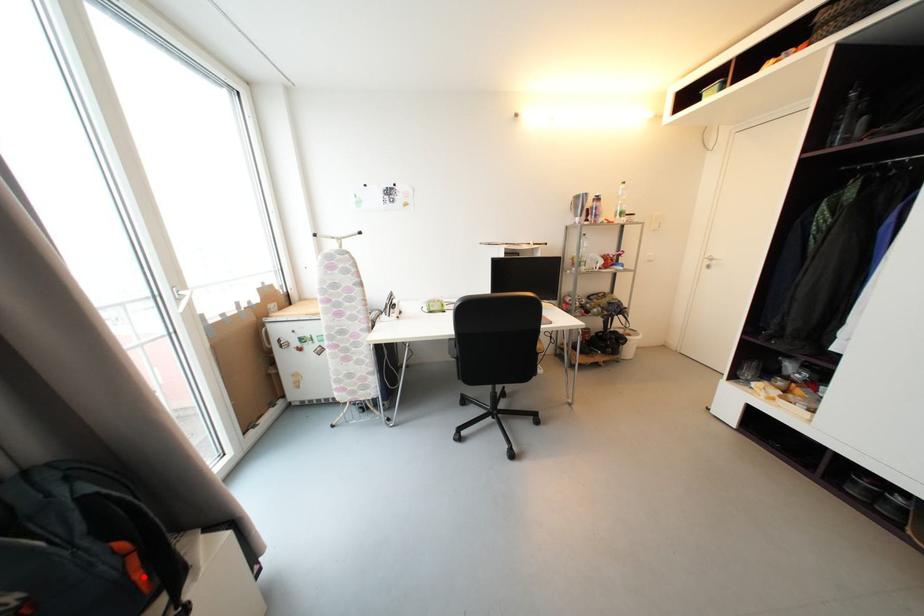
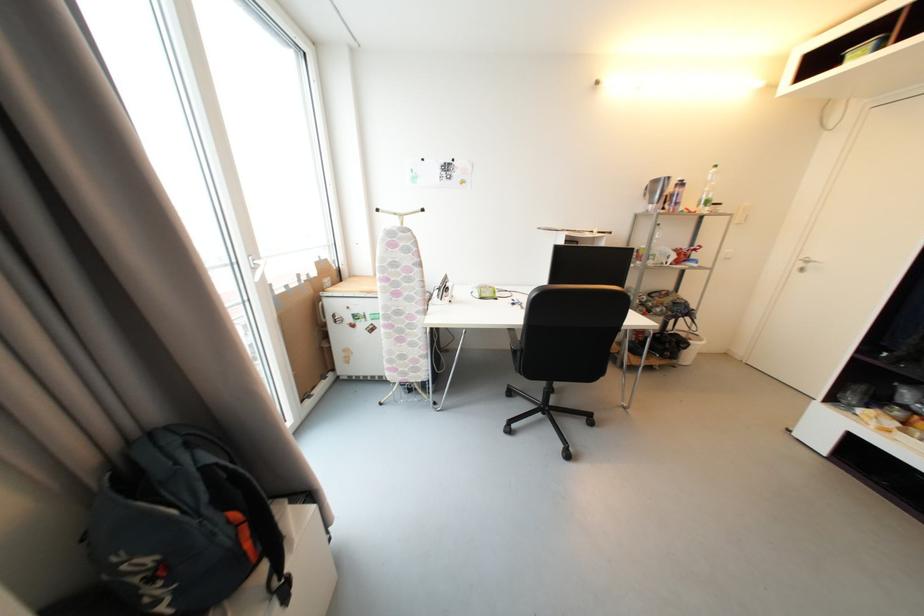
The point at the highlighted location is marked in the first image. Where is the corresponding point in the second image?

(253, 546)